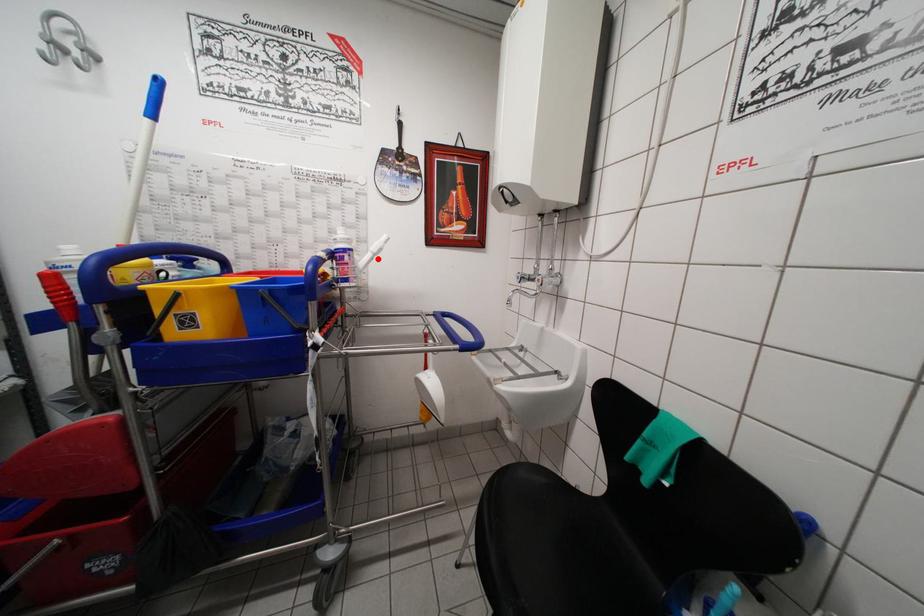
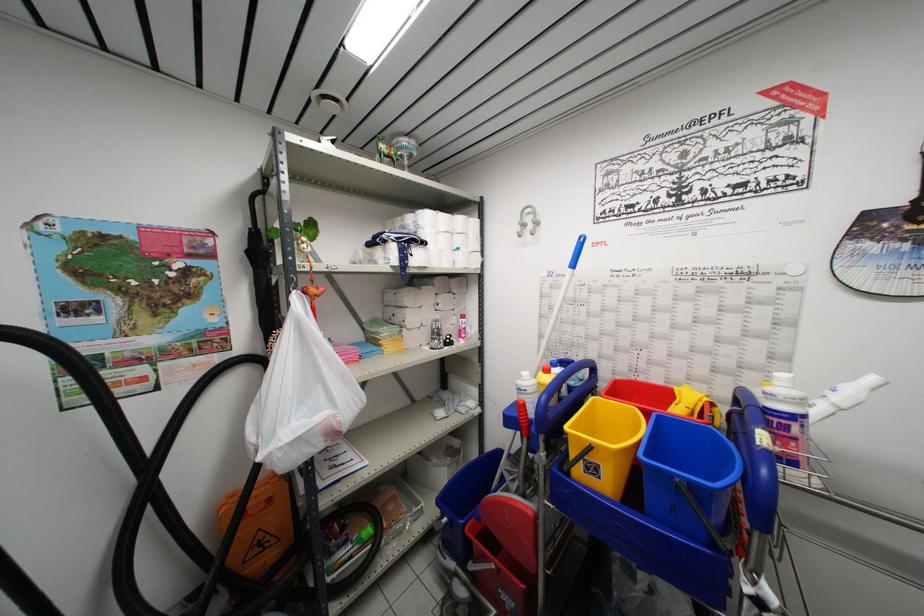
Question: I am providing you with two images of the same scene from different viewpoints. In image1, a red point is highlighted. Considering the same 3D point in image2, which of the following is correct?

Choices:
 (A) It is closer
 (B) It is farther

Answer: (A)